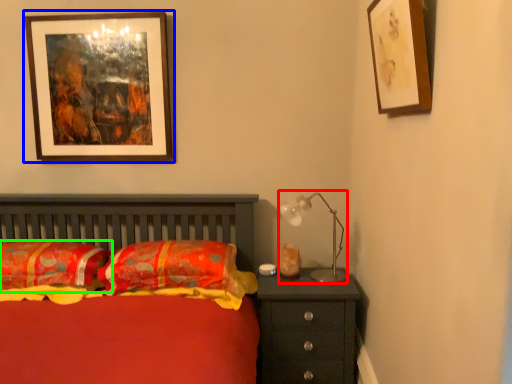
Question: Based on their relative distances, which object is farther from table lamp (highlighted by a red box)? Choose from picture frame (highlighted by a blue box) and pillow (highlighted by a green box).

Choices:
 (A) picture frame
 (B) pillow

Answer: (A)